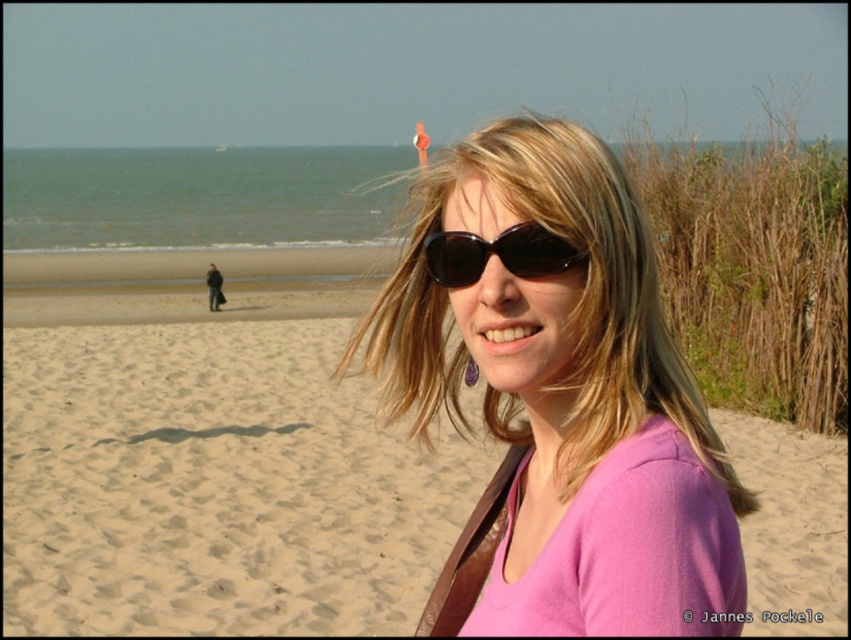
Question: Which object is the closest to the pink matte shirt at center?

Choices:
 (A) black matte sunglasses at center
 (B) sandy beach at center

Answer: (A)

Question: Does sandy beach at center have a larger size compared to pink matte shirt at center?

Choices:
 (A) yes
 (B) no

Answer: (A)

Question: Which point is farther to the camera?

Choices:
 (A) black matte sunglasses at center
 (B) sandy beach at center

Answer: (B)

Question: Observing the image, what is the correct spatial positioning of sandy beach at center in reference to black matte sunglasses at center?

Choices:
 (A) above
 (B) below

Answer: (B)

Question: Can you confirm if sandy beach at center is wider than pink matte shirt at center?

Choices:
 (A) yes
 (B) no

Answer: (A)

Question: Which of the following is the farthest from the observer?

Choices:
 (A) pink matte shirt at center
 (B) black matte sunglasses at center

Answer: (B)